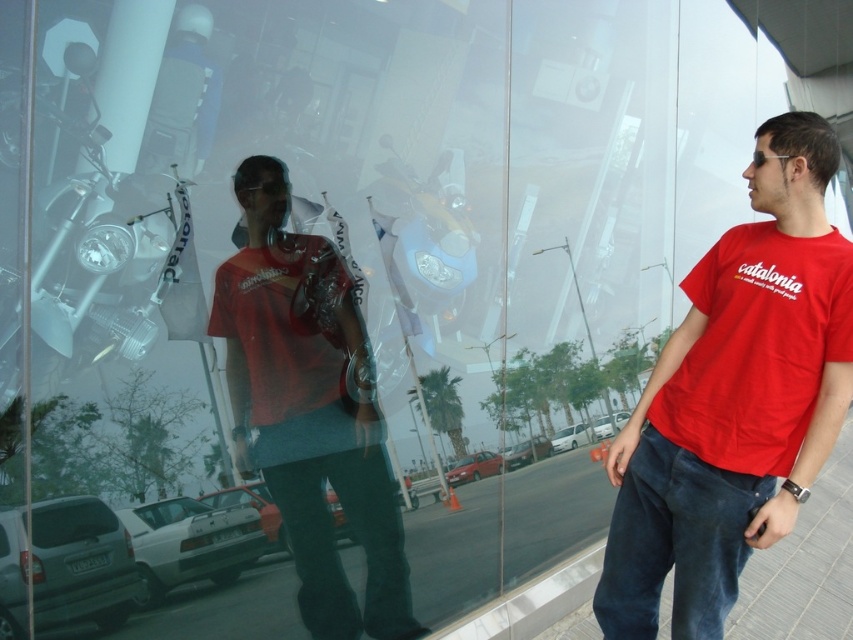
Question: Which is farther from the red cotton t-shirt at center?

Choices:
 (A) gray concrete pavement at lower center
 (B) matte red t-shirt at center
 (C) red cotton t-shirt at right

Answer: (A)

Question: Can you confirm if gray concrete pavement at lower center is positioned to the left of red cotton t-shirt at right?

Choices:
 (A) yes
 (B) no

Answer: (A)

Question: Considering the relative positions of gray concrete pavement at lower center and red cotton t-shirt at right in the image provided, where is gray concrete pavement at lower center located with respect to red cotton t-shirt at right?

Choices:
 (A) below
 (B) above

Answer: (A)

Question: Does matte red t-shirt at center appear on the right side of red cotton t-shirt at right?

Choices:
 (A) yes
 (B) no

Answer: (B)

Question: Among these points, which one is farthest from the camera?

Choices:
 (A) (834, 289)
 (B) (306, 534)
 (C) (624, 481)
 (D) (556, 600)

Answer: (D)

Question: Estimate the real-world distances between objects in this image. Which object is closer to the red cotton t-shirt at right?

Choices:
 (A) gray concrete pavement at lower center
 (B) matte red t-shirt at center

Answer: (B)